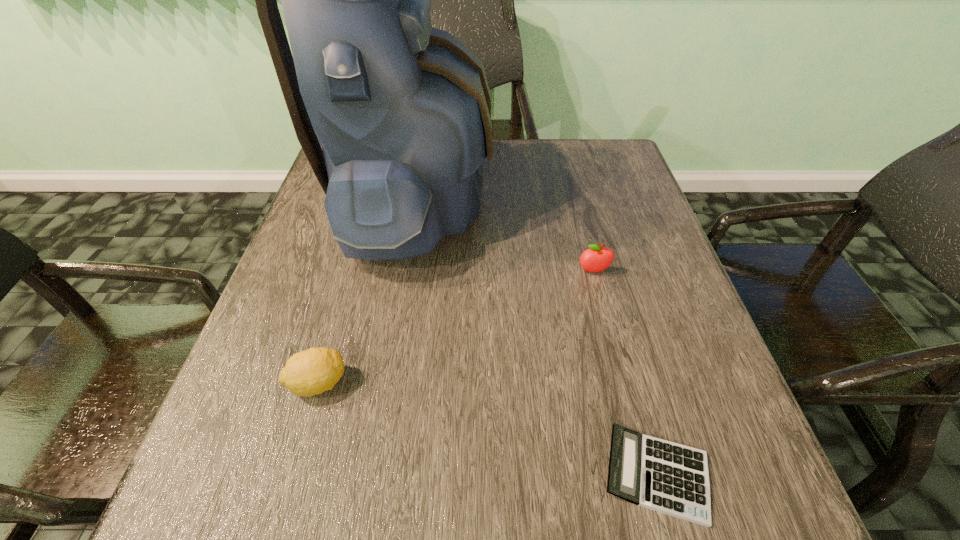
Where is `vacant area between the calculator and the apple`? The width and height of the screenshot is (960, 540). vacant area between the calculator and the apple is located at coordinates (625, 373).

I want to click on free spot between the apple and the lemon, so click(x=456, y=327).

Find the location of a particular element. This screenshot has height=540, width=960. empty space that is in between the tallest object and the third farthest object is located at coordinates (367, 291).

Where is `object that is the third closest to the apple`? The image size is (960, 540). object that is the third closest to the apple is located at coordinates (307, 373).

Select which object is the second closest to the lemon. Please provide its 2D coordinates. Your answer should be formatted as a tuple, i.e. [(x, y)], where the tuple contains the x and y coordinates of a point satisfying the conditions above.

[(664, 476)]

Locate an element on the screen. Image resolution: width=960 pixels, height=540 pixels. vacant space that satisfies the following two spatial constraints: 1. at the front pocket of the nearest object; 2. on the right side of the tallest object is located at coordinates (368, 475).

I want to click on vacant point that satisfies the following two spatial constraints: 1. on the front side of the apple; 2. at the stem end of the second nearest object, so click(622, 383).

In order to click on free region that satisfies the following two spatial constraints: 1. at the stem end of the second nearest object; 2. on the back side of the nearest object in this screenshot , I will do `click(292, 475)`.

This screenshot has width=960, height=540. What are the coordinates of `vacant point that satisfies the following two spatial constraints: 1. on the back side of the calculator; 2. at the front pocket of the tallest object` in the screenshot? It's located at (583, 199).

At what (x,y) coordinates should I click in order to perform the action: click on free spot that satisfies the following two spatial constraints: 1. on the back side of the nearest object; 2. at the stem end of the third farthest object. Please return your answer as a coordinate pair (x, y). Image resolution: width=960 pixels, height=540 pixels. Looking at the image, I should click on (632, 383).